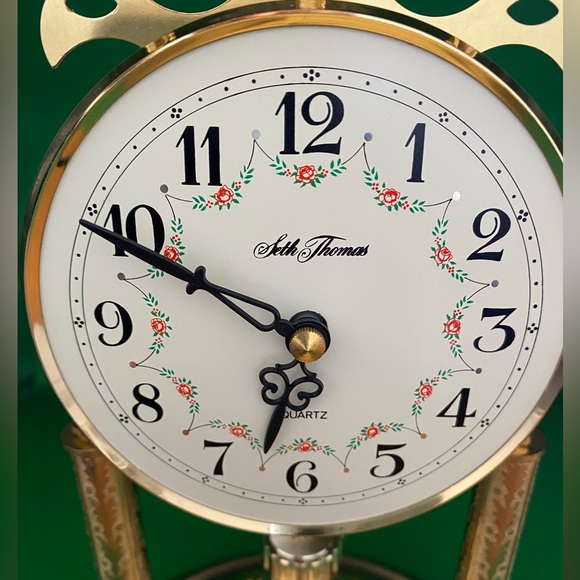
Identify the location of white interior section. (313, 47).